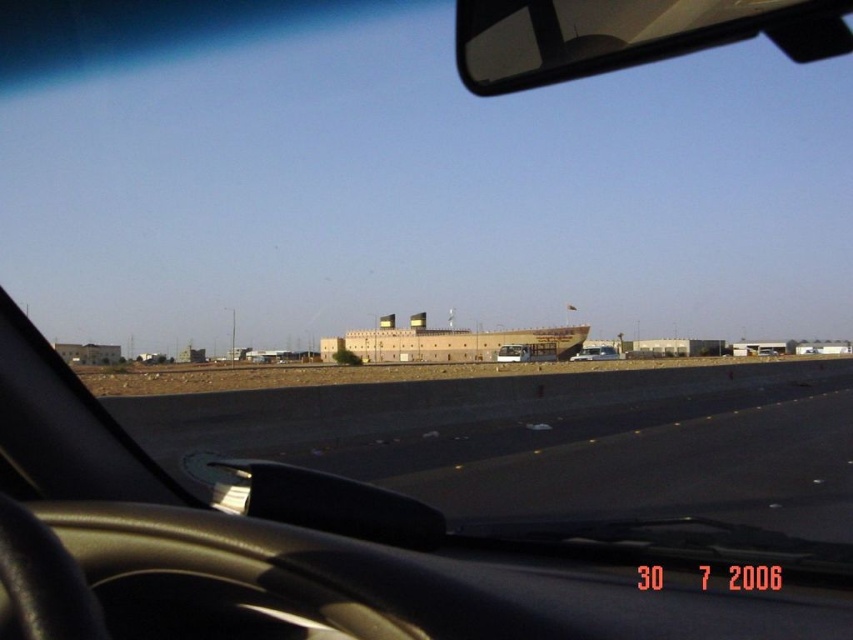
You are sitting in the driver seat of the vehicle shown in the scene. You want to check the blind spot behind the car. Can you see the transparent plastic view mirror at upper center in your rearview mirror?

The transparent plastic view mirror at upper center is located at point (625,35), which is outside the field of view of the rearview mirror positioned at the top right corner. Therefore, you cannot see it in your rearview mirror.

You are sitting in the driver seat of the vehicle shown in the scene. You want to check the blind spot behind the car using the transparent plastic view mirror at upper center. Considering the distance between you and the mirror, can you see the large ship structure in the distance through this mirror?

The transparent plastic view mirror at upper center is 12.13 feet away from the viewer. Since this distance is typical for vehicle mirrors, the driver should be able to see the large ship structure in the distance through the mirror as long as the mirror is properly adjusted to reflect the blind spot area.

You are driving a car and want to park in a spot that can accommodate both your matte black car at center and another vehicle. The white matte van at center is already parked there. Can the two vehicles fit side by side in the parking spot?

The white matte van at center is wider than the matte black car at center. Since the van is already occupying part of the parking spot, there might not be enough space left for the car to park alongside it. It depends on the total width of the parking spot, but given the van is wider, it could be challenging to fit both vehicles side by side.